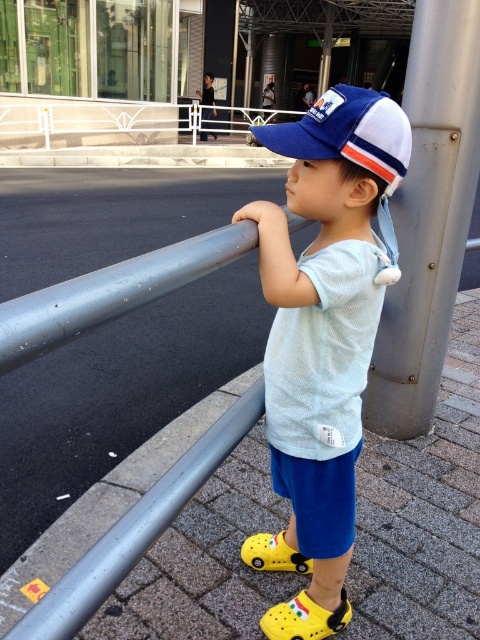
Is blue mesh baseball cap at center to the right of yellow rubber crocs at lower center from the viewer's perspective?

Indeed, blue mesh baseball cap at center is positioned on the right side of yellow rubber crocs at lower center.

Who is higher up, blue mesh baseball cap at center or yellow rubber crocs at lower center?

blue mesh baseball cap at center

Image resolution: width=480 pixels, height=640 pixels. What do you see at coordinates (348, 132) in the screenshot?
I see `blue mesh baseball cap at center` at bounding box center [348, 132].

In order to click on blue mesh baseball cap at center in this screenshot , I will do [348, 132].

Can you confirm if yellow rubber crocs at lower center is positioned to the left of yellow croc shoe at lower center?

In fact, yellow rubber crocs at lower center is to the right of yellow croc shoe at lower center.

Which is in front, point (344, 618) or point (269, 545)?

Point (344, 618)

Describe the element at coordinates (304, 618) in the screenshot. I see `yellow rubber crocs at lower center` at that location.

The image size is (480, 640). In order to click on yellow rubber crocs at lower center in this screenshot , I will do `click(304, 618)`.

What do you see at coordinates (324, 328) in the screenshot?
I see `matte blue cap at center` at bounding box center [324, 328].

Can you confirm if matte blue cap at center is positioned to the left of blue mesh baseball cap at center?

Yes, matte blue cap at center is to the left of blue mesh baseball cap at center.

Does point (334, 205) come behind point (355, 136)?

Yes, it is.

Identify the location of matte blue cap at center. The height and width of the screenshot is (640, 480). (324, 328).